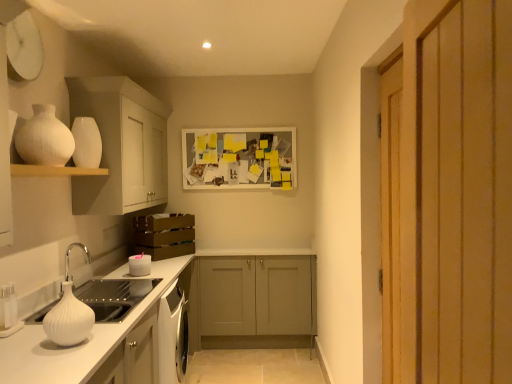
Locate an element on the screen. The height and width of the screenshot is (384, 512). free spot above white matte picture frame at center (from a real-world perspective) is located at coordinates (241, 126).